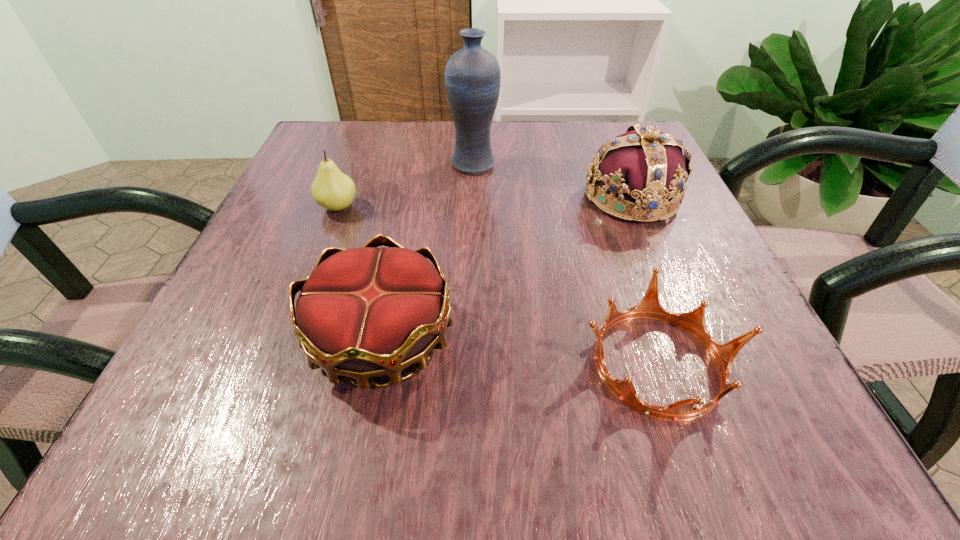
What are the coordinates of `free space between the second tallest object and the pear` in the screenshot? It's located at (485, 202).

The image size is (960, 540). I want to click on empty space between the tallest crown and the shortest crown, so click(644, 281).

Locate an element on the screen. The image size is (960, 540). object that stands as the second closest to the tallest crown is located at coordinates (693, 322).

Locate an element on the screen. Image resolution: width=960 pixels, height=540 pixels. the second closest object to the tallest object is located at coordinates (333, 190).

I want to click on the closest crown to the pear, so click(366, 312).

Select which crown appears as the closest to the pear. Please provide its 2D coordinates. Your answer should be formatted as a tuple, i.e. [(x, y)], where the tuple contains the x and y coordinates of a point satisfying the conditions above.

[(366, 312)]